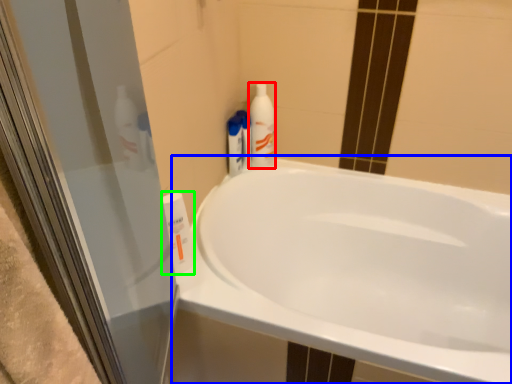
Question: Considering the real-world distances, which object is farthest from cleaning product (highlighted by a red box)? bathtub (highlighted by a blue box) or cleaning product (highlighted by a green box)?

Choices:
 (A) bathtub
 (B) cleaning product

Answer: (B)